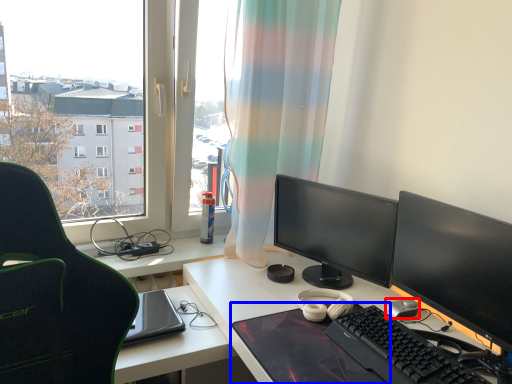
Question: Which object appears closest to the camera in this image, mouse (highlighted by a red box) or mousepad (highlighted by a blue box)?

Choices:
 (A) mouse
 (B) mousepad

Answer: (B)